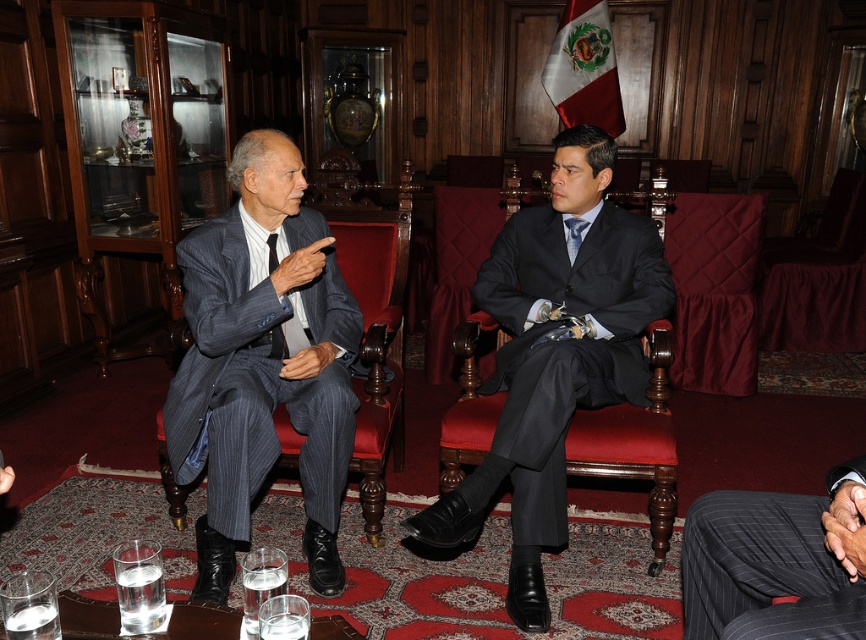
What is located at the coordinates point (777, 561) in the image?

The pinstriped fabric suit at center is located at point (777, 561).

What is located at the coordinates point (554, 355) in the image?

The point (554, 355) is occupied by the matte black suit at center.